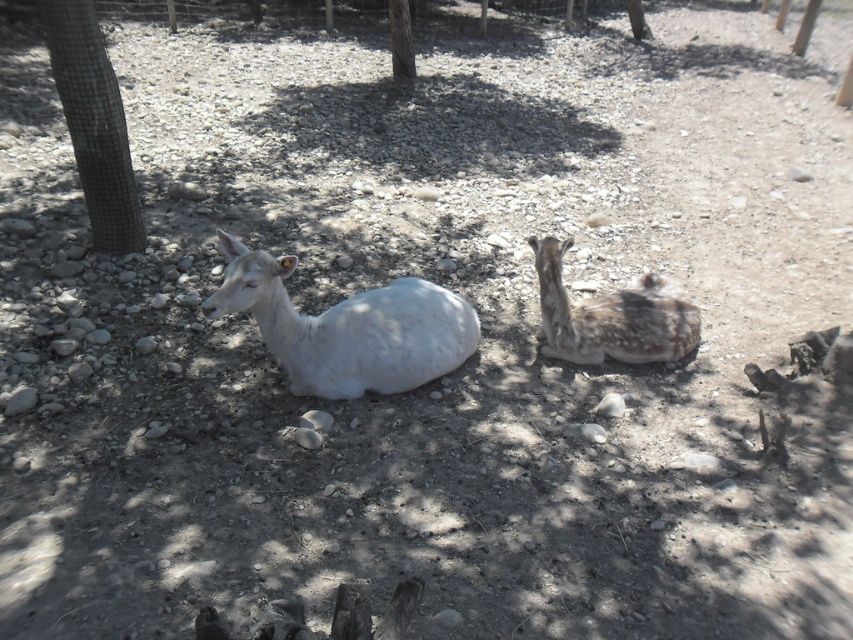
You are standing at the origin point of the image and want to reach the point labeled as point (625, 332). Which direction should you move first to reach it without passing through point (396, 36)?

Since point (625, 332) is in front of point (396, 36), you should move forward towards the direction of point (625, 332) to reach it without passing through the other point.

You are standing in front of the two deer resting on the stony ground. There are two points marked in the image. Which point, point [370,294] or point [412,72], is closer to you?

Point [370,294] is closer to the viewer than point [412,72].